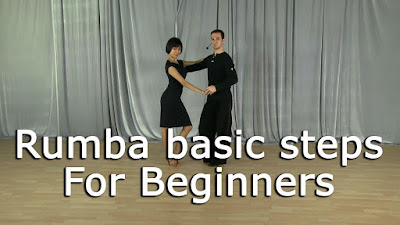
You are a GUI agent. You are given a task and a screenshot of the screen. Output one action in this format:
    pyautogui.click(x=<x>, y=<y>)
    Task: Click on the grey curtain
    This screenshot has width=400, height=225.
    Given the screenshot: What is the action you would take?
    pyautogui.click(x=369, y=70)